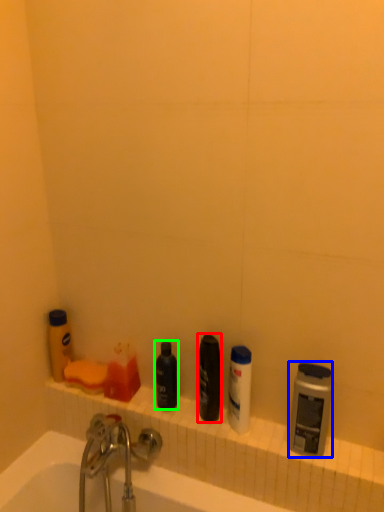
Question: Which is nearer to the toiletry (highlighted by a red box)? toiletry (highlighted by a blue box) or toiletry (highlighted by a green box).

Choices:
 (A) toiletry
 (B) toiletry

Answer: (B)